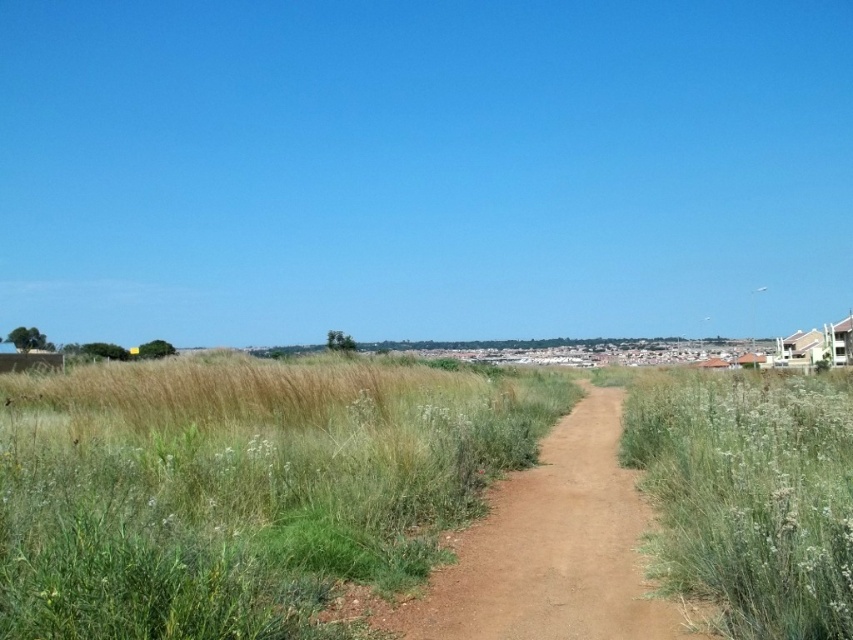
Does point (86, 554) come behind point (749, 634)?

No, it is in front of (749, 634).

Which is more to the right, green grassy at center or green grassy at right?

green grassy at right

Where is `green grassy at center`? green grassy at center is located at coordinates (241, 486).